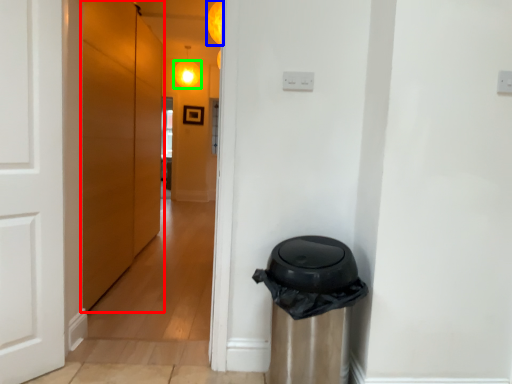
Question: Estimate the real-world distances between objects in this image. Which object is closer to door (highlighted by a red box), light (highlighted by a blue box) or light (highlighted by a green box)?

Choices:
 (A) light
 (B) light

Answer: (A)